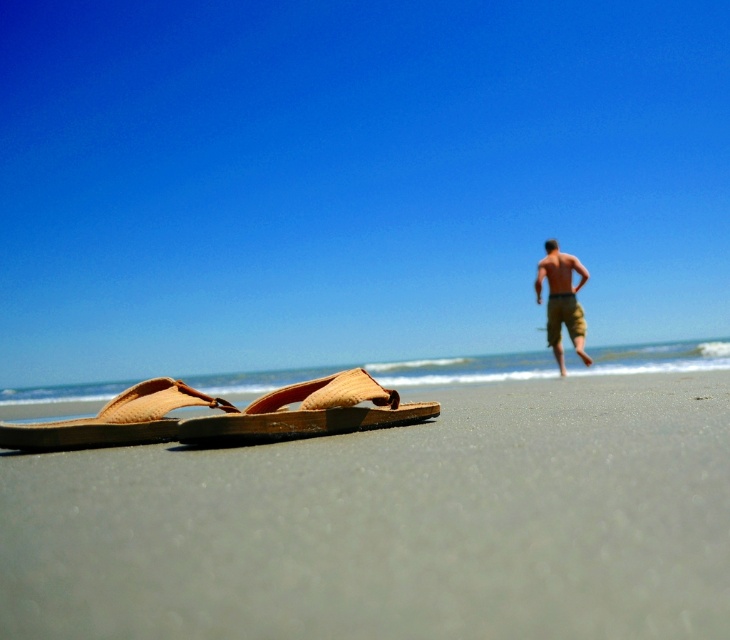
Does tan leather flip-flops at lower left have a lesser height compared to tan cotton shorts at right?

Indeed, tan leather flip-flops at lower left has a lesser height compared to tan cotton shorts at right.

The height and width of the screenshot is (640, 730). What are the coordinates of `tan leather flip-flops at lower left` in the screenshot? It's located at (393, 524).

The width and height of the screenshot is (730, 640). Find the location of `tan leather flip-flops at lower left`. tan leather flip-flops at lower left is located at coordinates (393, 524).

Does tan leather flip-flops at lower left appear on the right side of tan leather sandal at lower left?

Correct, you'll find tan leather flip-flops at lower left to the right of tan leather sandal at lower left.

Is point (618, 616) in front of point (57, 444)?

Yes, point (618, 616) is closer to viewer.

Who is more forward, (153, 536) or (180, 380)?

Positioned in front is point (153, 536).

Find the location of a particular element. This screenshot has height=640, width=730. tan leather flip-flops at lower left is located at coordinates (393, 524).

The image size is (730, 640). Describe the element at coordinates (307, 412) in the screenshot. I see `tan leather sandal at lower center` at that location.

Can you confirm if tan leather sandal at lower center is shorter than tan leather sandal at lower left?

Indeed, tan leather sandal at lower center has a lesser height compared to tan leather sandal at lower left.

Between point (326, 426) and point (23, 433), which one is positioned behind?

Positioned behind is point (23, 433).

Locate an element on the screen. Image resolution: width=730 pixels, height=640 pixels. tan leather sandal at lower center is located at coordinates (307, 412).